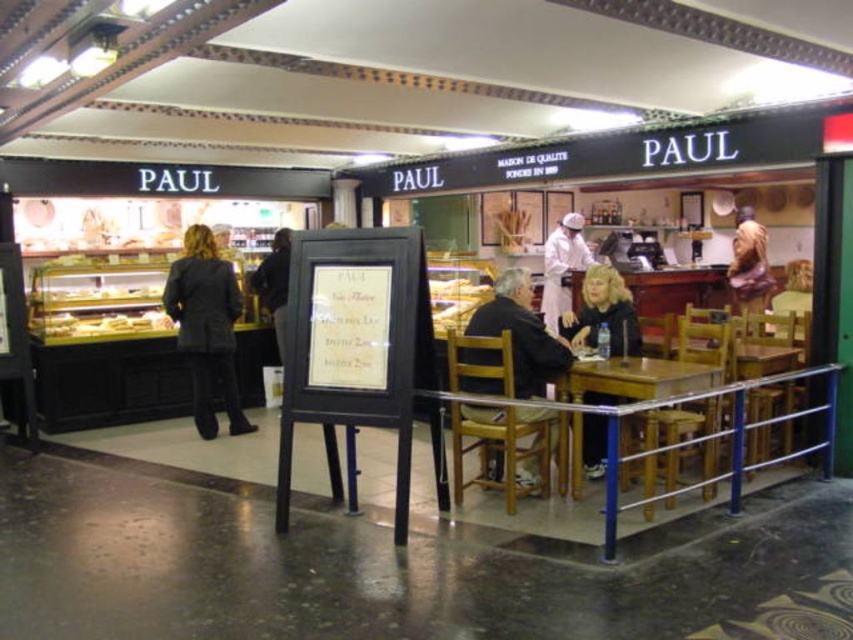
Does dark gray suit at left appear under smooth beige shirt at center?

Yes, dark gray suit at left is below smooth beige shirt at center.

Is dark gray suit at left shorter than smooth beige shirt at center?

Incorrect, dark gray suit at left's height does not fall short of smooth beige shirt at center's.

Which is in front, point (189, 273) or point (766, 326)?

Point (189, 273)

Find the location of a particular element. The height and width of the screenshot is (640, 853). dark gray suit at left is located at coordinates (206, 326).

Does wooden table at center come in front of blonde hair at table center?

Yes, wooden table at center is in front of blonde hair at table center.

Is point (709, 410) in front of point (592, 460)?

That is True.

Measure the distance between wooden table at center and camera.

The distance of wooden table at center from camera is 13.67 feet.

Where is `wooden table at center`? The height and width of the screenshot is (640, 853). wooden table at center is located at coordinates (639, 378).

Between dark gray suit at left and blonde hair at table center, which one appears on the right side from the viewer's perspective?

Positioned to the right is blonde hair at table center.

Between point (177, 333) and point (584, 328), which one is positioned behind?

The point (177, 333) is more distant.

Locate an element on the screen. Image resolution: width=853 pixels, height=640 pixels. dark gray suit at left is located at coordinates (206, 326).